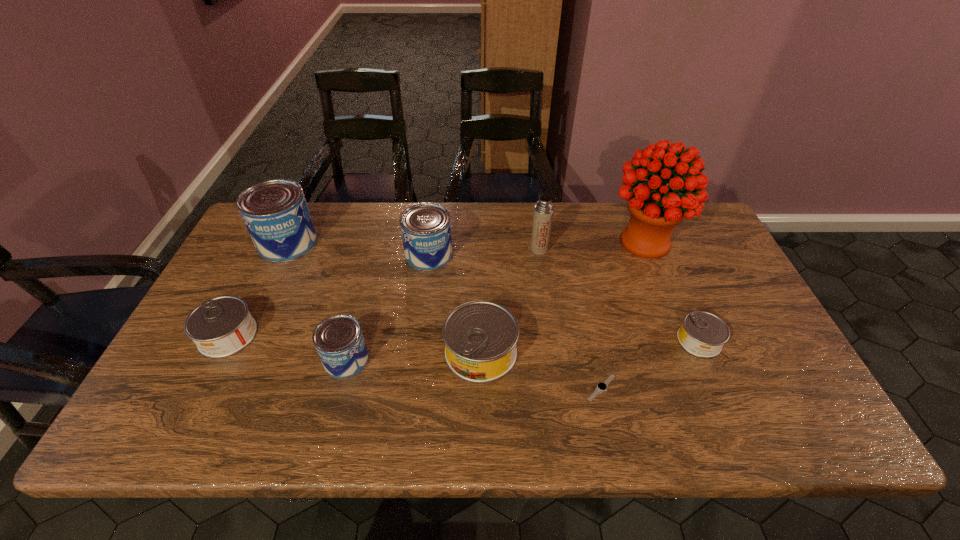
At what (x,y) coordinates should I click in order to perform the action: click on vacant space that is in between the shortest can and the smallest blue can. Please return your answer as a coordinate pair (x, y). Looking at the image, I should click on (522, 350).

Where is `free space that is in between the second smallest blue can and the rightmost can`? This screenshot has height=540, width=960. free space that is in between the second smallest blue can and the rightmost can is located at coordinates (564, 298).

Identify the location of vacant area that lies between the thermos bottle and the shortest can. The width and height of the screenshot is (960, 540). (619, 295).

The width and height of the screenshot is (960, 540). What are the coordinates of `free space between the second silver can from left to right and the nearest blue can` in the screenshot? It's located at (414, 356).

I want to click on free space between the second silver can from right to left and the smallest blue can, so (x=414, y=356).

At what (x,y) coordinates should I click in order to perform the action: click on free area in between the tallest can and the rightmost blue can. Please return your answer as a coordinate pair (x, y). This screenshot has width=960, height=540. Looking at the image, I should click on (358, 249).

Find the location of a particular element. The image size is (960, 540). object that is the sixth closest to the second shortest can is located at coordinates (602, 386).

Choose which object is the seventh nearest neighbor to the biggest silver can. Please provide its 2D coordinates. Your answer should be formatted as a tuple, i.e. [(x, y)], where the tuple contains the x and y coordinates of a point satisfying the conditions above.

[(275, 212)]

Locate an element on the screen. The width and height of the screenshot is (960, 540). the fifth closest can to the biggest silver can is located at coordinates (222, 326).

Where is `can that is the second closest to the smallest silver can`? This screenshot has width=960, height=540. can that is the second closest to the smallest silver can is located at coordinates (425, 227).